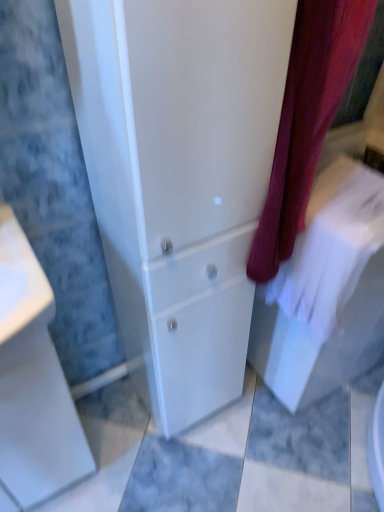
Question: Is white glossy porcelain at lower left looking in the opposite direction of white glossy cabinet at center?

Choices:
 (A) yes
 (B) no

Answer: (B)

Question: From a real-world perspective, is white glossy porcelain at lower left positioned over white glossy cabinet at center based on gravity?

Choices:
 (A) yes
 (B) no

Answer: (B)

Question: Is the depth of white glossy porcelain at lower left greater than that of white glossy cabinet at center?

Choices:
 (A) yes
 (B) no

Answer: (A)

Question: Considering the relative positions of white glossy porcelain at lower left and white glossy cabinet at center in the image provided, is white glossy porcelain at lower left to the left of white glossy cabinet at center from the viewer's perspective?

Choices:
 (A) no
 (B) yes

Answer: (B)

Question: From the image's perspective, is white glossy porcelain at lower left over white glossy cabinet at center?

Choices:
 (A) no
 (B) yes

Answer: (A)

Question: Is white cotton bath towel at right taller or shorter than velvet burgundy curtain at center?

Choices:
 (A) tall
 (B) short

Answer: (B)

Question: From the image's perspective, is white cotton bath towel at right above or below velvet burgundy curtain at center?

Choices:
 (A) above
 (B) below

Answer: (B)

Question: Would you say white cotton bath towel at right is inside or outside velvet burgundy curtain at center?

Choices:
 (A) inside
 (B) outside

Answer: (B)

Question: Is point (359, 266) positioned closer to the camera than point (304, 119)?

Choices:
 (A) closer
 (B) farther

Answer: (B)

Question: Which is correct: white glossy porcelain at lower left is inside velvet burgundy curtain at center, or outside of it?

Choices:
 (A) outside
 (B) inside

Answer: (A)

Question: Considering the positions of white glossy porcelain at lower left and velvet burgundy curtain at center in the image, is white glossy porcelain at lower left wider or thinner than velvet burgundy curtain at center?

Choices:
 (A) thin
 (B) wide

Answer: (A)

Question: Visually, is white glossy porcelain at lower left positioned to the left or to the right of velvet burgundy curtain at center?

Choices:
 (A) right
 (B) left

Answer: (B)

Question: Considering their positions, is white glossy porcelain at lower left located in front of or behind velvet burgundy curtain at center?

Choices:
 (A) behind
 (B) front

Answer: (A)

Question: Considering the positions of white glossy porcelain at lower left and white glossy cabinet at center in the image, is white glossy porcelain at lower left taller or shorter than white glossy cabinet at center?

Choices:
 (A) tall
 (B) short

Answer: (B)

Question: In terms of width, does white glossy porcelain at lower left look wider or thinner when compared to white glossy cabinet at center?

Choices:
 (A) thin
 (B) wide

Answer: (A)